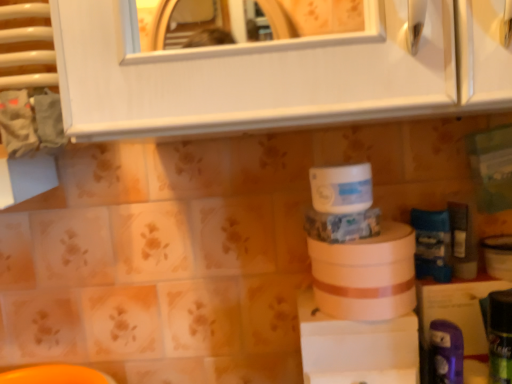
Question: From the image's perspective, does green matte can at lower right, the 4th toiletry from the back, appear lower than purple plastic toothbrush at lower right, the 3th toiletry viewed from the back?

Choices:
 (A) no
 (B) yes

Answer: (A)

Question: From a real-world perspective, does green matte can at lower right, the 4th toiletry from the back, sit lower than purple plastic toothbrush at lower right, the 3th toiletry viewed from the back?

Choices:
 (A) no
 (B) yes

Answer: (A)

Question: Is the depth of green matte can at lower right, the 4th toiletry from the back, less than that of purple plastic toothbrush at lower right, which appears as the 2th toiletry when viewed from the front?

Choices:
 (A) no
 (B) yes

Answer: (B)

Question: Considering the relative sizes of green matte can at lower right, the first toiletry viewed from the front, and purple plastic toothbrush at lower right, which appears as the 2th toiletry when viewed from the front, in the image provided, is green matte can at lower right, the first toiletry viewed from the front, taller than purple plastic toothbrush at lower right, which appears as the 2th toiletry when viewed from the front,?

Choices:
 (A) yes
 (B) no

Answer: (A)

Question: Is green matte can at lower right, the 4th toiletry from the back, positioned behind purple plastic toothbrush at lower right, the 3th toiletry viewed from the back?

Choices:
 (A) yes
 (B) no

Answer: (B)

Question: Could purple plastic toothbrush at lower right, the 3th toiletry viewed from the back, be considered to be inside green matte can at lower right, the first toiletry viewed from the front?

Choices:
 (A) yes
 (B) no

Answer: (B)

Question: Does white matte toilet paper at center, which is counted as the second toilet paper, starting from the top, have a smaller size compared to white matte jar at center, the 2th toilet paper positioned from the bottom?

Choices:
 (A) no
 (B) yes

Answer: (A)

Question: From the image's perspective, is white matte toilet paper at center, which is counted as the second toilet paper, starting from the top, located beneath white matte jar at center, the first toilet paper viewed from the top?

Choices:
 (A) yes
 (B) no

Answer: (A)

Question: Is white matte toilet paper at center, which is counted as the second toilet paper, starting from the top, facing away from white matte jar at center, the 2th toilet paper positioned from the bottom?

Choices:
 (A) no
 (B) yes

Answer: (A)

Question: Does white matte toilet paper at center, acting as the 1th toilet paper starting from the bottom, lie in front of white matte jar at center, the 2th toilet paper positioned from the bottom?

Choices:
 (A) no
 (B) yes

Answer: (A)

Question: Can you confirm if white matte toilet paper at center, which is counted as the second toilet paper, starting from the top, is taller than white matte jar at center, the 2th toilet paper positioned from the bottom?

Choices:
 (A) yes
 (B) no

Answer: (A)

Question: Considering the relative positions of white matte toilet paper at center, which is counted as the second toilet paper, starting from the top, and white matte jar at center, the first toilet paper viewed from the top, in the image provided, is white matte toilet paper at center, which is counted as the second toilet paper, starting from the top, to the right of white matte jar at center, the first toilet paper viewed from the top, from the viewer's perspective?

Choices:
 (A) yes
 (B) no

Answer: (A)

Question: Is green matte can at lower right, the first toiletry viewed from the front, to the right of white matte toilet paper at center, acting as the 1th toilet paper starting from the bottom, from the viewer's perspective?

Choices:
 (A) no
 (B) yes

Answer: (B)